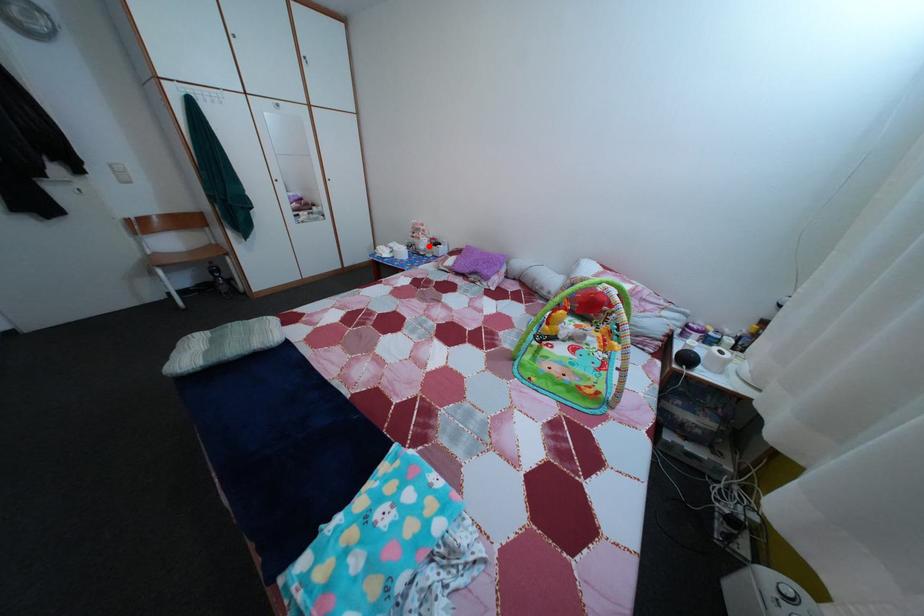
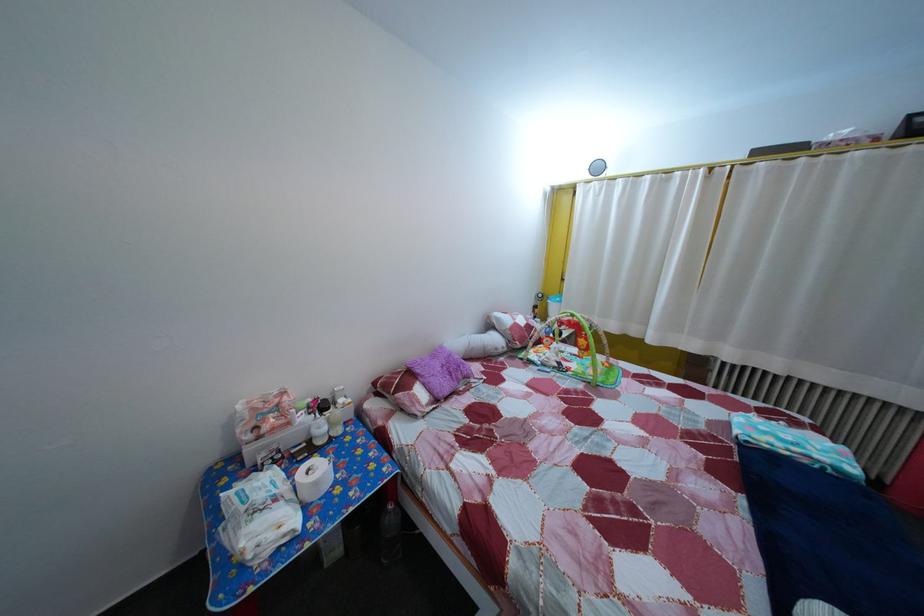
Question: I am providing you with two images of the same scene from different viewpoints. A red point is shown in image1. For the corresponding object point in image2, is it positioned nearer or farther from the camera?

Choices:
 (A) Nearer
 (B) Farther

Answer: (B)